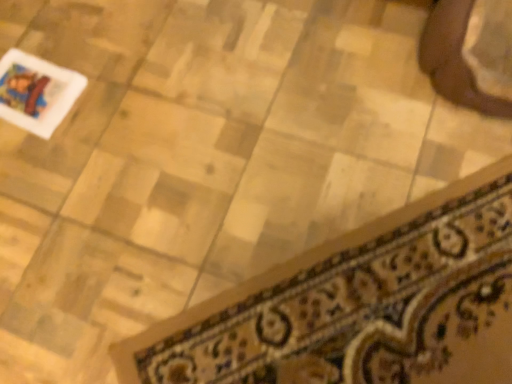
Question: From the image's perspective, is brown leather shoe at upper right located above or below patterned fabric doormat at lower right?

Choices:
 (A) below
 (B) above

Answer: (B)

Question: Choose the correct answer: Is brown leather shoe at upper right inside patterned fabric doormat at lower right or outside it?

Choices:
 (A) inside
 (B) outside

Answer: (B)

Question: From a real-world perspective, is brown leather shoe at upper right physically located above or below patterned fabric doormat at lower right?

Choices:
 (A) below
 (B) above

Answer: (B)

Question: Is patterned fabric doormat at lower right taller or shorter than brown leather shoe at upper right?

Choices:
 (A) tall
 (B) short

Answer: (B)

Question: From a real-world perspective, is patterned fabric doormat at lower right physically located above or below brown leather shoe at upper right?

Choices:
 (A) above
 (B) below

Answer: (B)

Question: From the image's perspective, is patterned fabric doormat at lower right located above or below brown leather shoe at upper right?

Choices:
 (A) above
 (B) below

Answer: (B)

Question: In the image, is patterned fabric doormat at lower right positioned in front of or behind brown leather shoe at upper right?

Choices:
 (A) behind
 (B) front

Answer: (B)